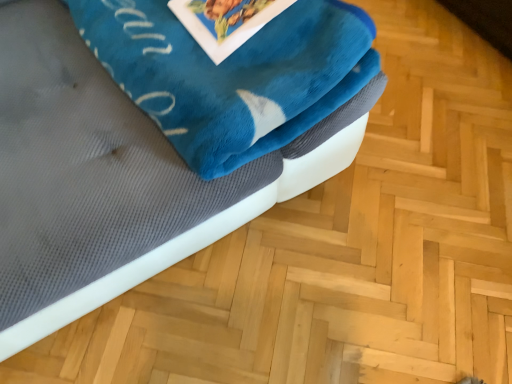
Question: Is velvety blue blanket at upper left with blue plush bath towel at upper left?

Choices:
 (A) yes
 (B) no

Answer: (B)

Question: Is there a large distance between velvety blue blanket at upper left and blue plush bath towel at upper left?

Choices:
 (A) yes
 (B) no

Answer: (B)

Question: Would you say blue plush bath towel at upper left is part of velvety blue blanket at upper left's contents?

Choices:
 (A) no
 (B) yes

Answer: (B)

Question: Can you confirm if velvety blue blanket at upper left is positioned to the right of blue plush bath towel at upper left?

Choices:
 (A) yes
 (B) no

Answer: (B)

Question: Is velvety blue blanket at upper left further to the viewer compared to blue plush bath towel at upper left?

Choices:
 (A) yes
 (B) no

Answer: (B)

Question: Is velvety blue blanket at upper left turned away from blue plush bath towel at upper left?

Choices:
 (A) yes
 (B) no

Answer: (A)

Question: Is the depth of blue plush bath towel at upper left greater than that of velvety blue blanket at upper left?

Choices:
 (A) no
 (B) yes

Answer: (B)

Question: From a real-world perspective, does blue plush bath towel at upper left sit lower than velvety blue blanket at upper left?

Choices:
 (A) no
 (B) yes

Answer: (A)

Question: Is blue plush bath towel at upper left next to velvety blue blanket at upper left?

Choices:
 (A) yes
 (B) no

Answer: (B)

Question: Is blue plush bath towel at upper left smaller than velvety blue blanket at upper left?

Choices:
 (A) yes
 (B) no

Answer: (A)

Question: Does blue plush bath towel at upper left have a lesser height compared to velvety blue blanket at upper left?

Choices:
 (A) no
 (B) yes

Answer: (B)

Question: Is blue plush bath towel at upper left turned away from velvety blue blanket at upper left?

Choices:
 (A) yes
 (B) no

Answer: (A)

Question: From a real-world perspective, is blue plush bath towel at upper left physically located above or below velvety blue blanket at upper left?

Choices:
 (A) above
 (B) below

Answer: (A)